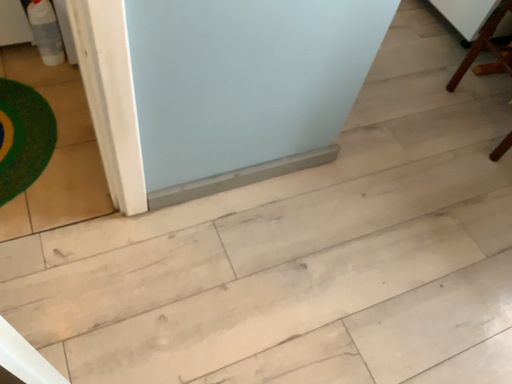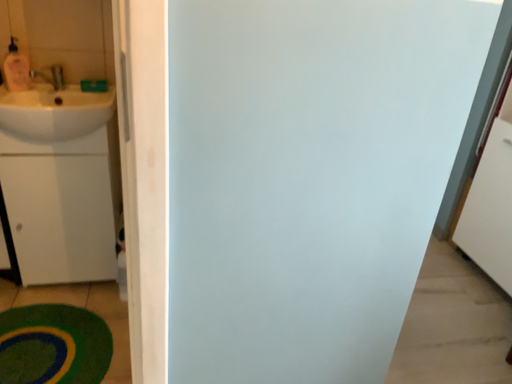
Question: How did the camera likely rotate when shooting the video?

Choices:
 (A) rotated right
 (B) rotated left

Answer: (B)